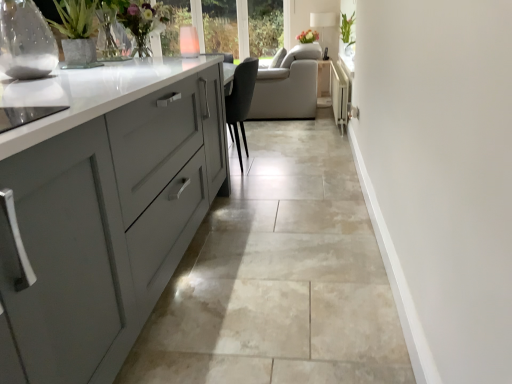
Question: From a real-world perspective, is beige tile floor at center under clear glass vase at center, positioned as the second glass vase in left-to-right order?

Choices:
 (A) no
 (B) yes

Answer: (B)

Question: From a real-world perspective, is beige tile floor at center on top of clear glass vase at center, which is the 1th glass vase from top to bottom?

Choices:
 (A) no
 (B) yes

Answer: (A)

Question: From the image's perspective, is beige tile floor at center over clear glass vase at center, positioned as the second glass vase in left-to-right order?

Choices:
 (A) yes
 (B) no

Answer: (B)

Question: Considering the relative sizes of beige tile floor at center and clear glass vase at center, the 1th glass vase viewed from the back, in the image provided, is beige tile floor at center taller than clear glass vase at center, the 1th glass vase viewed from the back,?

Choices:
 (A) no
 (B) yes

Answer: (A)

Question: Does beige tile floor at center have a larger size compared to clear glass vase at center, which appears as the second glass vase when ordered from the bottom?

Choices:
 (A) no
 (B) yes

Answer: (B)

Question: Is beige tile floor at center smaller than clear glass vase at center, positioned as the second glass vase in left-to-right order?

Choices:
 (A) no
 (B) yes

Answer: (A)

Question: Does white matte floral arrangement at upper center, the 1th floral arrangement positioned from the right, have a smaller size compared to translucent glass vase at upper left, which is the 1th floral arrangement in left-to-right order?

Choices:
 (A) yes
 (B) no

Answer: (A)

Question: From a real-world perspective, is white matte floral arrangement at upper center, the 2th floral arrangement when ordered from bottom to top, on translucent glass vase at upper left, which ranks as the first floral arrangement in bottom-to-top order?

Choices:
 (A) yes
 (B) no

Answer: (B)

Question: Does white matte floral arrangement at upper center, marked as the 2th floral arrangement in a front-to-back arrangement, touch translucent glass vase at upper left, which is the 1th floral arrangement in left-to-right order?

Choices:
 (A) no
 (B) yes

Answer: (A)

Question: Considering the relative sizes of white matte floral arrangement at upper center, the second floral arrangement from the left, and translucent glass vase at upper left, which ranks as the first floral arrangement in bottom-to-top order, in the image provided, is white matte floral arrangement at upper center, the second floral arrangement from the left, bigger than translucent glass vase at upper left, which ranks as the first floral arrangement in bottom-to-top order,?

Choices:
 (A) yes
 (B) no

Answer: (B)

Question: Could translucent glass vase at upper left, the 2th floral arrangement when ordered from right to left, be considered to be inside white matte floral arrangement at upper center, marked as the first floral arrangement in a top-to-bottom arrangement?

Choices:
 (A) no
 (B) yes

Answer: (A)

Question: Is white matte floral arrangement at upper center, marked as the 2th floral arrangement in a front-to-back arrangement, located outside translucent glass vase at upper left, the 1th floral arrangement in the front-to-back sequence?

Choices:
 (A) no
 (B) yes

Answer: (B)

Question: From a real-world perspective, is green glossy plant at upper right positioned under clear glass vase at center, which appears as the second glass vase when ordered from the bottom, based on gravity?

Choices:
 (A) no
 (B) yes

Answer: (A)